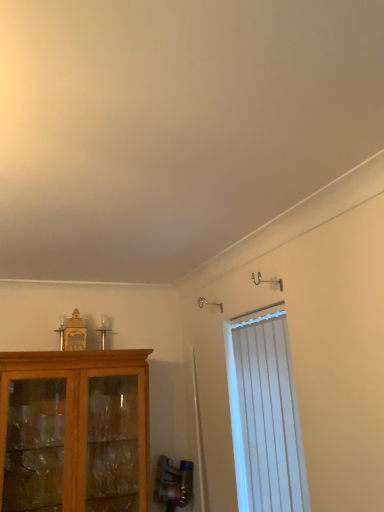
In order to face matte wood cabinet at left, should I rotate leftwards or rightwards?

A 15.571 degree turn to the left will do.

In order to click on matte wood cabinet at left in this screenshot , I will do pyautogui.click(x=75, y=422).

Image resolution: width=384 pixels, height=512 pixels. What do you see at coordinates (75, 422) in the screenshot?
I see `matte wood cabinet at left` at bounding box center [75, 422].

The height and width of the screenshot is (512, 384). What do you see at coordinates (265, 413) in the screenshot?
I see `white vertical blinds at right` at bounding box center [265, 413].

Where is `white vertical blinds at right`? The height and width of the screenshot is (512, 384). white vertical blinds at right is located at coordinates (265, 413).

Find the location of a particular element. matte wood cabinet at left is located at coordinates (x=75, y=422).

Would you say white vertical blinds at right is to the left or to the right of matte wood cabinet at left in the picture?

Based on their positions, white vertical blinds at right is located to the right of matte wood cabinet at left.

Which is in front, white vertical blinds at right or matte wood cabinet at left?

white vertical blinds at right is more forward.

Is point (277, 351) closer or farther from the camera than point (32, 369)?

Point (277, 351).

From the image's perspective, which is above, white vertical blinds at right or matte wood cabinet at left?

white vertical blinds at right appears higher in the image.

From a real-world perspective, is white vertical blinds at right physically located above or below matte wood cabinet at left?

white vertical blinds at right is above matte wood cabinet at left.

Looking at this image, considering the relative sizes of white vertical blinds at right and matte wood cabinet at left in the image provided, is white vertical blinds at right wider than matte wood cabinet at left?

In fact, white vertical blinds at right might be narrower than matte wood cabinet at left.

Considering the sizes of objects white vertical blinds at right and matte wood cabinet at left in the image provided, who is taller, white vertical blinds at right or matte wood cabinet at left?

white vertical blinds at right is taller.

Who is smaller, white vertical blinds at right or matte wood cabinet at left?

With smaller size is white vertical blinds at right.

Is matte wood cabinet at left inside white vertical blinds at right?

No, white vertical blinds at right does not contain matte wood cabinet at left.

Looking at this image, is white vertical blinds at right touching matte wood cabinet at left?

white vertical blinds at right and matte wood cabinet at left are clearly separated.

Does white vertical blinds at right turn towards matte wood cabinet at left?

No, white vertical blinds at right is not facing towards matte wood cabinet at left.

Looking at this image, can you tell me how much white vertical blinds at right and matte wood cabinet at left differ in facing direction?

90.9 degrees.

You are a GUI agent. You are given a task and a screenshot of the screen. Output one action in this format:
    pyautogui.click(x=<x>, y=<y>)
    Task: Click on the cabinetry on the left side of white vertical blinds at right
    The image size is (384, 512).
    Given the screenshot: What is the action you would take?
    pyautogui.click(x=75, y=422)

Between matte wood cabinet at left and white vertical blinds at right, which one appears on the right side from the viewer's perspective?

white vertical blinds at right is more to the right.

Which object is more forward, matte wood cabinet at left or white vertical blinds at right?

white vertical blinds at right is more forward.

Does point (19, 352) appear closer or farther from the camera than point (258, 404)?

Clearly, point (19, 352) is more distant from the camera than point (258, 404).

From the image's perspective, which is above, matte wood cabinet at left or white vertical blinds at right?

white vertical blinds at right.

From a real-world perspective, which object stands above the other?

white vertical blinds at right is physically above.

Is matte wood cabinet at left wider or thinner than white vertical blinds at right?

Considering their sizes, matte wood cabinet at left looks broader than white vertical blinds at right.

Does matte wood cabinet at left have a greater height compared to white vertical blinds at right?

No, matte wood cabinet at left is not taller than white vertical blinds at right.

Which of these two, matte wood cabinet at left or white vertical blinds at right, is bigger?

Bigger between the two is matte wood cabinet at left.

Is matte wood cabinet at left completely or partially outside of white vertical blinds at right?

Yes, matte wood cabinet at left is outside of white vertical blinds at right.

Would you say matte wood cabinet at left is a long distance from white vertical blinds at right?

matte wood cabinet at left is near white vertical blinds at right, not far away.

Is matte wood cabinet at left positioned with its back to white vertical blinds at right?

No, matte wood cabinet at left is not facing away from white vertical blinds at right.

You are a GUI agent. You are given a task and a screenshot of the screen. Output one action in this format:
    pyautogui.click(x=<x>, y=<y>)
    Task: Click on the cabinetry behind the white vertical blinds at right
    The image size is (384, 512).
    Given the screenshot: What is the action you would take?
    pyautogui.click(x=75, y=422)

Where is `window located on the right of matte wood cabinet at left`? The height and width of the screenshot is (512, 384). window located on the right of matte wood cabinet at left is located at coordinates (265, 413).

The image size is (384, 512). Identify the location of cabinetry below the white vertical blinds at right (from the image's perspective). (75, 422).